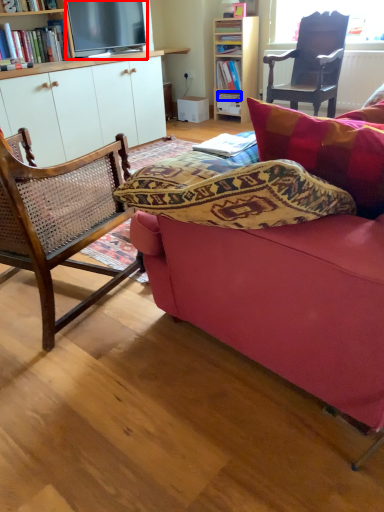
Question: Which object appears closest to the camera in this image, television (highlighted by a red box) or book (highlighted by a blue box)?

Choices:
 (A) television
 (B) book

Answer: (A)